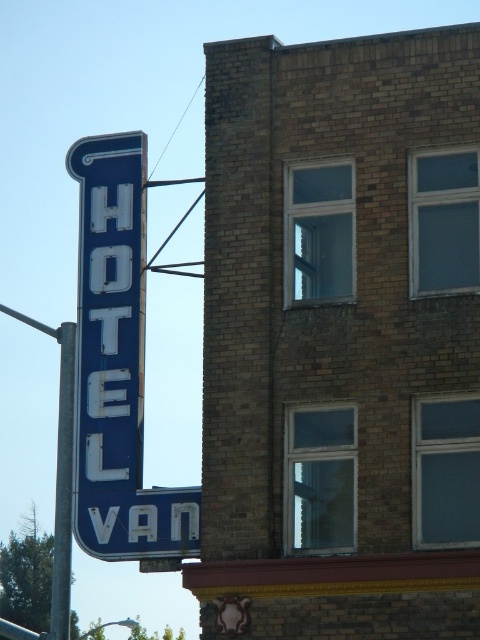
Question: Does blue metallic sign at left have a greater width compared to metallic pole at left?

Choices:
 (A) yes
 (B) no

Answer: (B)

Question: Which point appears closest to the camera in this image?

Choices:
 (A) (61, 570)
 (B) (128, 145)

Answer: (A)

Question: Is blue metallic sign at left bigger than metallic pole at left?

Choices:
 (A) no
 (B) yes

Answer: (A)

Question: Considering the relative positions of blue metallic sign at left and metallic pole at left in the image provided, where is blue metallic sign at left located with respect to metallic pole at left?

Choices:
 (A) below
 (B) above

Answer: (B)

Question: Among these points, which one is nearest to the camera?

Choices:
 (A) (63, 604)
 (B) (128, 262)

Answer: (B)